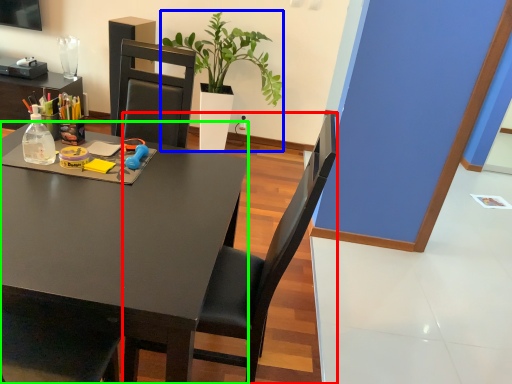
Question: Which object is the farthest from chair (highlighted by a red box)? Choose among these: houseplant (highlighted by a blue box) or desk (highlighted by a green box).

Choices:
 (A) houseplant
 (B) desk

Answer: (A)